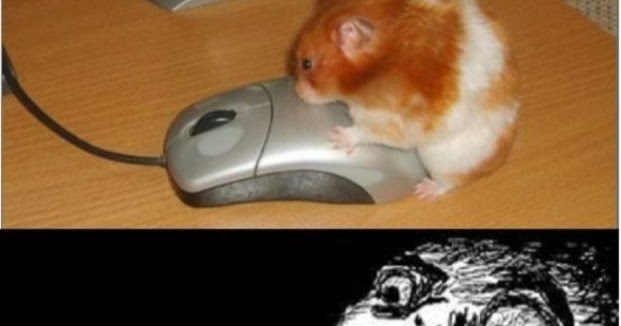
The width and height of the screenshot is (621, 326). What are the coordinates of `wooden surface` in the screenshot? It's located at (136, 107).